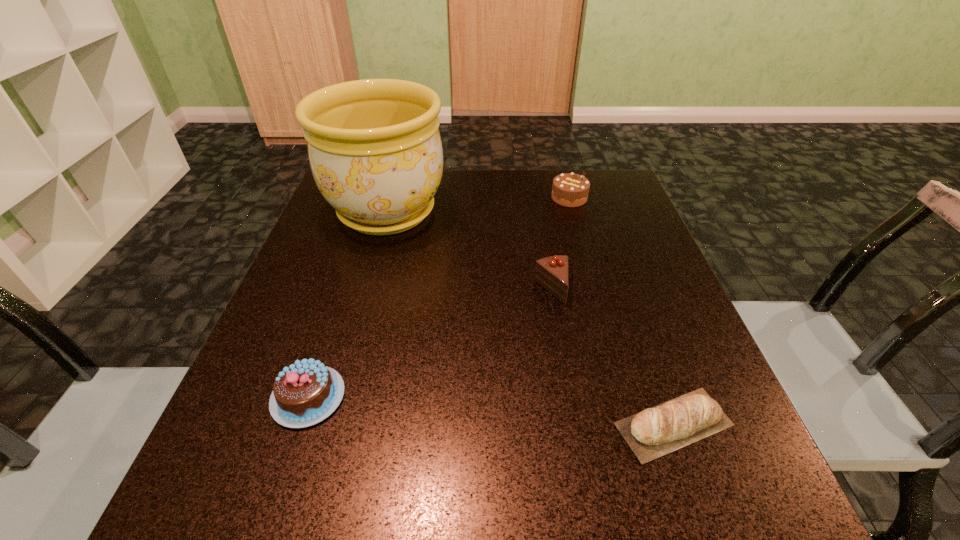
This screenshot has height=540, width=960. I want to click on free space between the pita bread and the leftmost chocolate cake, so click(x=491, y=410).

This screenshot has width=960, height=540. Find the location of `vacant space that's between the flowerpot and the pita bread`. vacant space that's between the flowerpot and the pita bread is located at coordinates (530, 318).

Locate an element on the screen. empty space between the third farthest object and the shortest object is located at coordinates (612, 357).

I want to click on free point between the flowerpot and the farthest chocolate cake, so click(478, 205).

You are a GUI agent. You are given a task and a screenshot of the screen. Output one action in this format:
    pyautogui.click(x=<x>, y=<y>)
    Task: Click on the vacant region between the pita bread and the flowerpot
    The height and width of the screenshot is (540, 960).
    Given the screenshot: What is the action you would take?
    pyautogui.click(x=530, y=318)

Select which object is the second closest to the tallest object. Please provide its 2D coordinates. Your answer should be formatted as a tuple, i.e. [(x, y)], where the tuple contains the x and y coordinates of a point satisfying the conditions above.

[(569, 190)]

Locate an element on the screen. Image resolution: width=960 pixels, height=540 pixels. object that ranks as the third closest to the farthest chocolate cake is located at coordinates (696, 414).

Where is `chocolate cake that stands as the second closest to the second nearest chocolate cake`? This screenshot has height=540, width=960. chocolate cake that stands as the second closest to the second nearest chocolate cake is located at coordinates (306, 392).

Select which chocolate cake is the second closest to the pita bread. Please provide its 2D coordinates. Your answer should be formatted as a tuple, i.e. [(x, y)], where the tuple contains the x and y coordinates of a point satisfying the conditions above.

[(306, 392)]

Locate an element on the screen. The image size is (960, 540). free space that satisfies the following two spatial constraints: 1. on the front side of the pita bread; 2. on the right side of the rightmost chocolate cake is located at coordinates (633, 424).